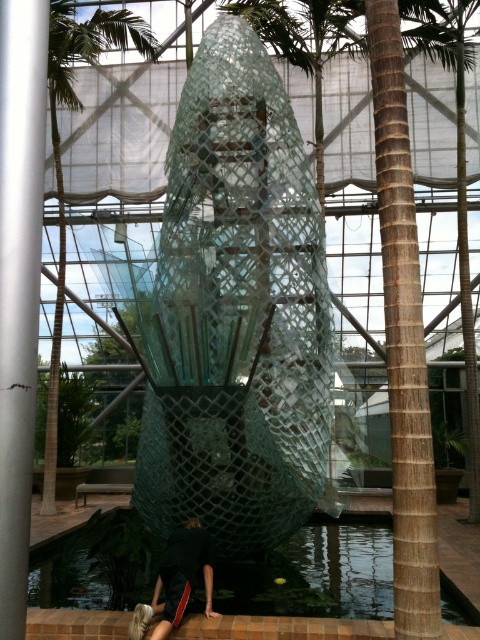
You are a visitor standing in the conservatory and want to take a photo of the transparent mesh sculpture at center and the black fabric at lower center. Which object will appear larger in your photo?

The transparent mesh sculpture at center will appear larger in your photo because it is closer to you than the black fabric at lower center.

You are an interior designer planning to place a new piece of furniture in the conservatory. You need to know which object is wider between the transparent mesh sculpture at center and the silver metallic pole at left. Which one is wider?

The transparent mesh sculpture at center is wider than the silver metallic pole at left according to the description.

You are a visitor in the conservatory and want to take a photo of the transparent mesh sculpture at center without the brown textured palm tree at right blocking the view. Is there enough space between them to do so?

The transparent mesh sculpture at center occupies less space than brown textured palm tree at right, so there is sufficient space between them to take a photo without the palm tree blocking the view.